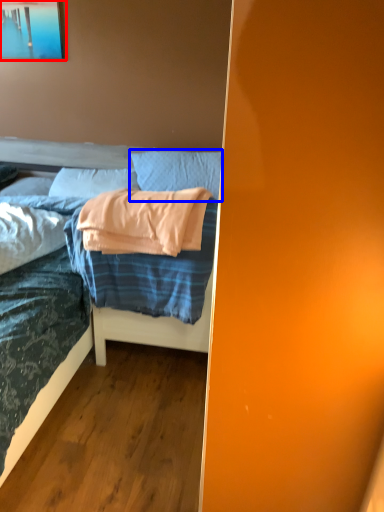
Question: Which object appears farthest to the camera in this image, picture frame (highlighted by a red box) or pillow (highlighted by a blue box)?

Choices:
 (A) picture frame
 (B) pillow

Answer: (A)